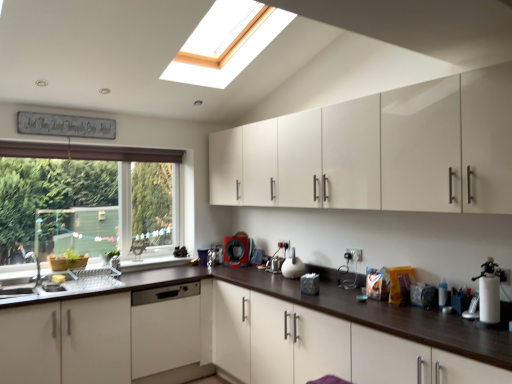
Question: Does black plastic coffee machine at center have a larger size compared to glossy white cabinets at upper center, placed as the 2th cabinetry when sorted from bottom to top?

Choices:
 (A) yes
 (B) no

Answer: (B)

Question: From the image's perspective, is black plastic coffee machine at center beneath glossy white cabinets at upper center, placed as the 2th cabinetry when sorted from bottom to top?

Choices:
 (A) no
 (B) yes

Answer: (B)

Question: From a real-world perspective, does black plastic coffee machine at center sit lower than glossy white cabinets at upper center, the 1th cabinetry viewed from the top?

Choices:
 (A) yes
 (B) no

Answer: (A)

Question: Is black plastic coffee machine at center turned away from glossy white cabinets at upper center, placed as the 2th cabinetry when sorted from bottom to top?

Choices:
 (A) no
 (B) yes

Answer: (A)

Question: Does black plastic coffee machine at center turn towards glossy white cabinets at upper center, the 1th cabinetry viewed from the top?

Choices:
 (A) no
 (B) yes

Answer: (A)

Question: Considering the relative sizes of black plastic coffee machine at center and glossy white cabinets at upper center, placed as the 2th cabinetry when sorted from bottom to top, in the image provided, is black plastic coffee machine at center taller than glossy white cabinets at upper center, placed as the 2th cabinetry when sorted from bottom to top,?

Choices:
 (A) yes
 (B) no

Answer: (B)

Question: Is glossy white cabinets at upper center, placed as the 2th cabinetry when sorted from bottom to top, turned away from white matte dishwasher at center?

Choices:
 (A) no
 (B) yes

Answer: (A)

Question: Considering the relative sizes of glossy white cabinets at upper center, placed as the 2th cabinetry when sorted from bottom to top, and white matte dishwasher at center in the image provided, is glossy white cabinets at upper center, placed as the 2th cabinetry when sorted from bottom to top, wider than white matte dishwasher at center?

Choices:
 (A) no
 (B) yes

Answer: (B)

Question: Is glossy white cabinets at upper center, the 1th cabinetry viewed from the top, taller than white matte dishwasher at center?

Choices:
 (A) no
 (B) yes

Answer: (B)

Question: Is glossy white cabinets at upper center, the 1th cabinetry viewed from the top, oriented towards white matte dishwasher at center?

Choices:
 (A) yes
 (B) no

Answer: (B)

Question: Is glossy white cabinets at upper center, placed as the 2th cabinetry when sorted from bottom to top, located outside white matte dishwasher at center?

Choices:
 (A) yes
 (B) no

Answer: (A)

Question: Is glossy white cabinets at upper center, the 1th cabinetry viewed from the top, smaller than white matte dishwasher at center?

Choices:
 (A) no
 (B) yes

Answer: (A)

Question: Does green matte window at left have a smaller size compared to black plastic coffee machine at center?

Choices:
 (A) yes
 (B) no

Answer: (B)